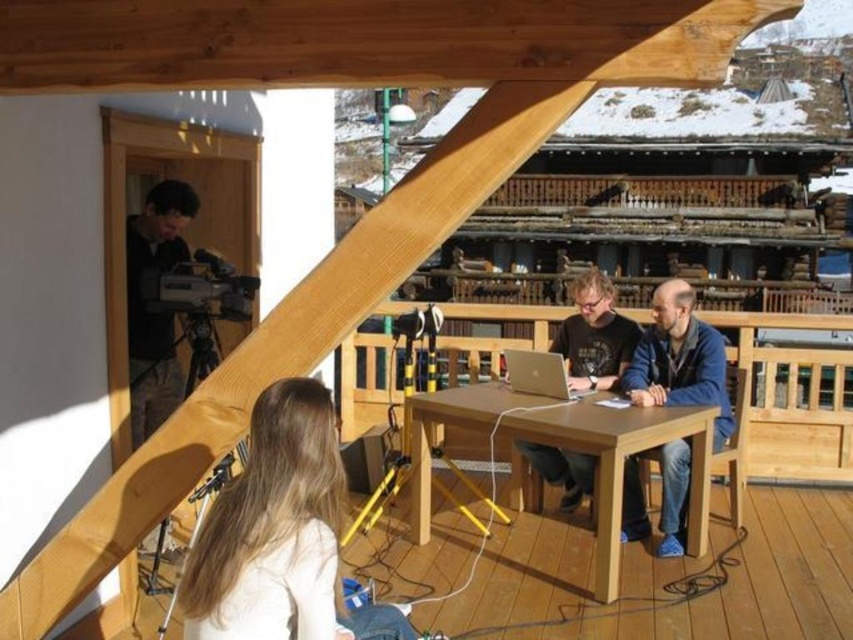
You are a photographer trying to capture a closeup of the light brown hair at lower center and the light brown wooden table at center. Which object would require a wider lens to capture fully in the frame?

The light brown wooden table at center is larger than the light brown hair at lower center, so it would require a wider lens to capture fully in the frame.

You are trying to determine if the light brown hair at lower center can fit on the light brown wooden table at center without overlapping the edges. Based on their sizes, is this possible?

The light brown hair at lower center is narrower than the light brown wooden table at center, so it can fit without overlapping the edges.

You are a delivery person who needs to place a 12 inch long package between the matte black shirt at center and the silver metallic laptop at center on the wooden table. Is there enough space to fit the package between them?

The distance between the matte black shirt at center and the silver metallic laptop at center is 14.18 inches, which is greater than the 12 inch package. Therefore, there is enough space to fit the package between them.